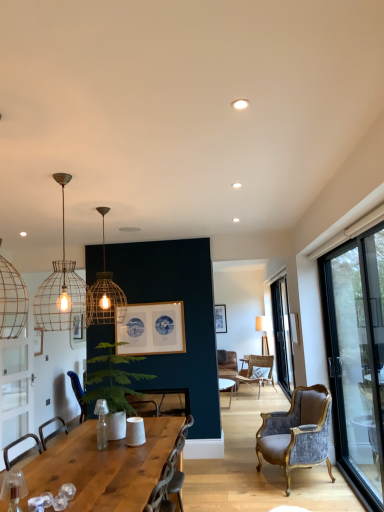
Question: Can you confirm if green leafy plant at center is wider than metal wire pendant light at upper left, marked as the first lamp in a front-to-back arrangement?

Choices:
 (A) yes
 (B) no

Answer: (A)

Question: Is green leafy plant at center not near metal wire pendant light at upper left, positioned as the second lamp in back-to-front order?

Choices:
 (A) no
 (B) yes

Answer: (A)

Question: Is green leafy plant at center to the left of metal wire pendant light at upper left, marked as the first lamp in a front-to-back arrangement, from the viewer's perspective?

Choices:
 (A) no
 (B) yes

Answer: (A)

Question: Is green leafy plant at center not within metal wire pendant light at upper left, positioned as the second lamp in back-to-front order?

Choices:
 (A) yes
 (B) no

Answer: (A)

Question: From the image's perspective, is green leafy plant at center over metal wire pendant light at upper left, positioned as the second lamp in back-to-front order?

Choices:
 (A) yes
 (B) no

Answer: (B)

Question: From a real-world perspective, is matte gold wire cage pendant light at upper center, acting as the second lamp starting from the front, positioned above or below velvet grey chair at right, the second chair positioned from the front?

Choices:
 (A) below
 (B) above

Answer: (B)

Question: From their relative heights in the image, would you say matte gold wire cage pendant light at upper center, which is the first lamp from back to front, is taller or shorter than velvet grey chair at right, the second chair positioned from the front?

Choices:
 (A) short
 (B) tall

Answer: (B)

Question: Considering their positions, is matte gold wire cage pendant light at upper center, acting as the second lamp starting from the front, located in front of or behind velvet grey chair at right, the 2th chair positioned from the left?

Choices:
 (A) front
 (B) behind

Answer: (A)

Question: Is matte gold wire cage pendant light at upper center, acting as the second lamp starting from the front, inside the boundaries of velvet grey chair at right, the 2th chair positioned from the left, or outside?

Choices:
 (A) inside
 (B) outside

Answer: (B)

Question: Based on their positions, is metal wire pendant light at upper left, marked as the first lamp in a front-to-back arrangement, located to the left or right of velvet grey chair at right, the second chair positioned from the back?

Choices:
 (A) right
 (B) left

Answer: (B)

Question: Is metal wire pendant light at upper left, positioned as the second lamp in back-to-front order, inside the boundaries of velvet grey chair at right, the second chair positioned from the front, or outside?

Choices:
 (A) inside
 (B) outside

Answer: (B)

Question: Does point (64, 227) appear closer or farther from the camera than point (294, 418)?

Choices:
 (A) farther
 (B) closer

Answer: (B)

Question: From a real-world perspective, is metal wire pendant light at upper left, marked as the first lamp in a front-to-back arrangement, positioned above or below velvet grey chair at right, the second chair positioned from the front?

Choices:
 (A) below
 (B) above

Answer: (B)

Question: Based on their sizes in the image, would you say transparent glass door at right, marked as the 1th window in a right-to-left arrangement, is bigger or smaller than metal wire pendant light at upper left, marked as the first lamp in a front-to-back arrangement?

Choices:
 (A) big
 (B) small

Answer: (A)

Question: Is transparent glass door at right, which is the second window in front-to-back order, taller or shorter than metal wire pendant light at upper left, positioned as the second lamp in back-to-front order?

Choices:
 (A) tall
 (B) short

Answer: (A)